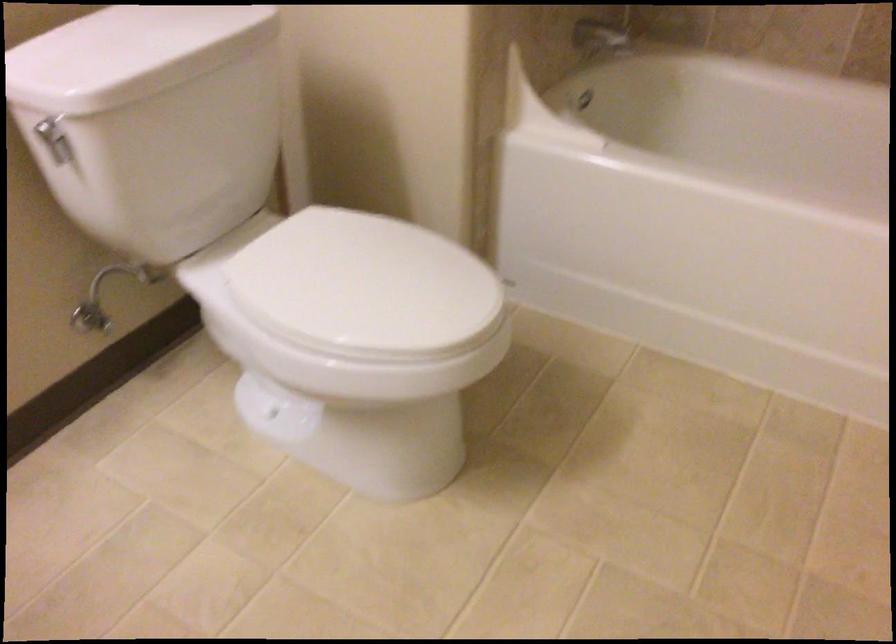
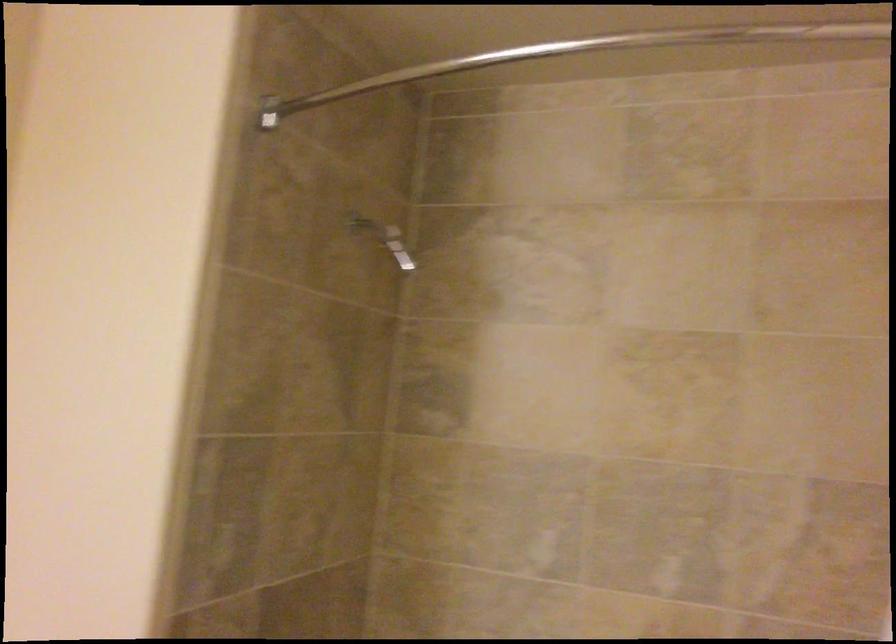
Question: How did the camera likely rotate?

Choices:
 (A) Left
 (B) Right
 (C) Up
 (D) Down

Answer: (C)